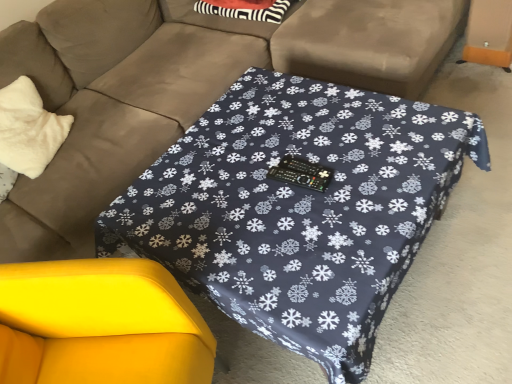
Question: Is dark blue fabric table at center to the left or to the right of yellow fabric swivel chair at lower left in the image?

Choices:
 (A) right
 (B) left

Answer: (A)

Question: In terms of height, does dark blue fabric table at center look taller or shorter compared to yellow fabric swivel chair at lower left?

Choices:
 (A) tall
 (B) short

Answer: (B)

Question: Which of these objects is positioned farthest from the yellow fabric swivel chair at lower left?

Choices:
 (A) matte brown couch at center
 (B) dark blue fabric table at center
 (C) white fluffy pillow at left

Answer: (C)

Question: Based on their relative distances, which object is nearer to the dark blue fabric table at center?

Choices:
 (A) white fluffy pillow at left
 (B) matte brown couch at center
 (C) yellow fabric swivel chair at lower left

Answer: (C)